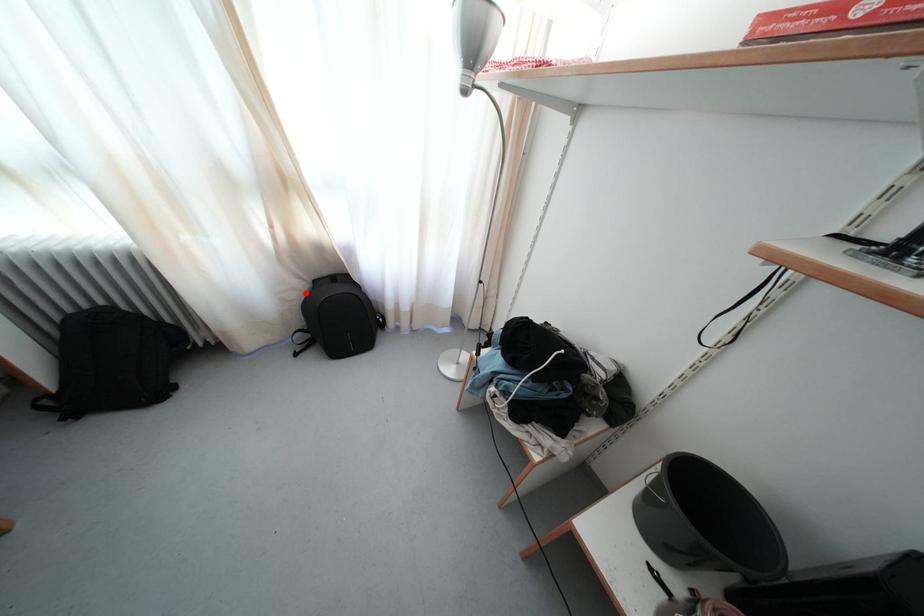
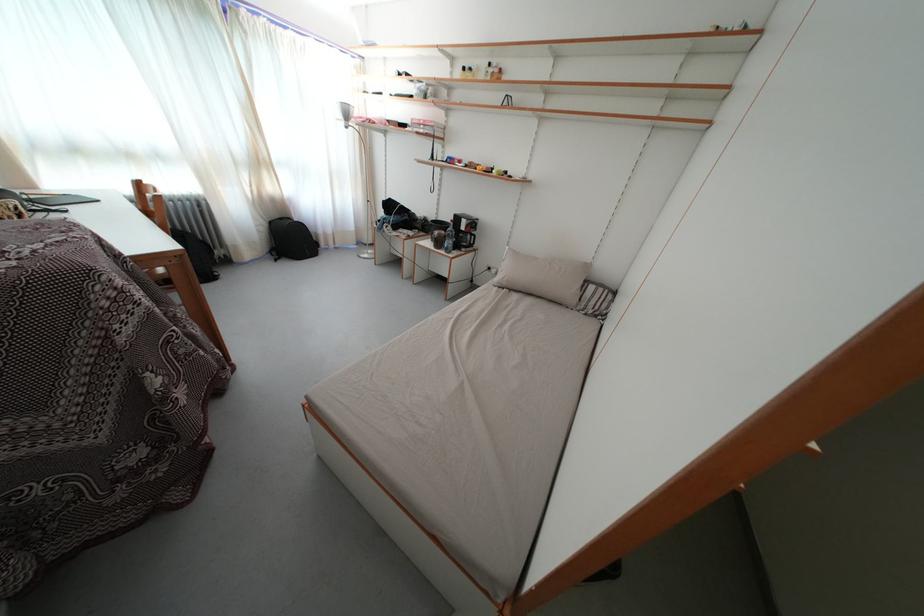
The point at the highlighted location is marked in the first image. Where is the corresponding point in the second image?

(272, 230)